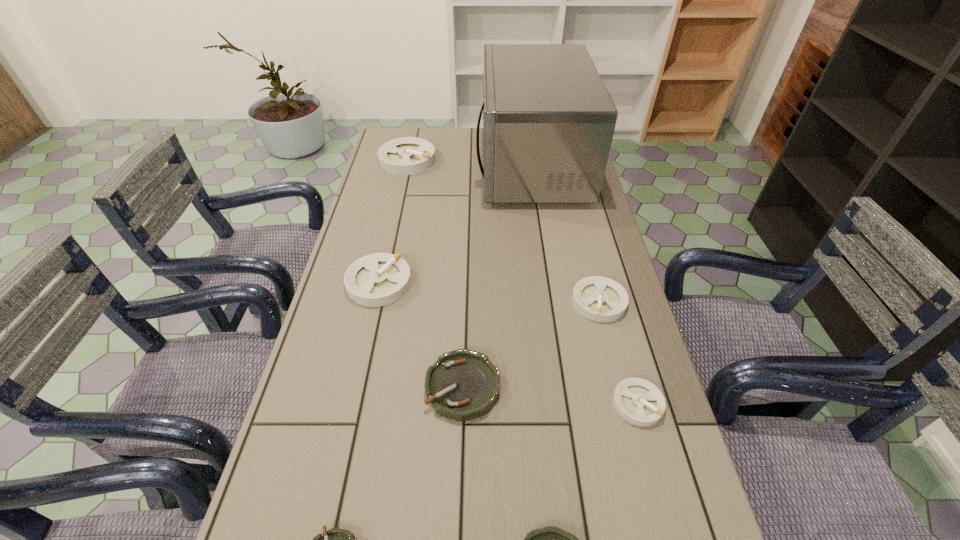
Image resolution: width=960 pixels, height=540 pixels. I want to click on microwave oven that is at the right edge, so click(x=548, y=120).

The image size is (960, 540). I want to click on object situated at the far left corner, so (x=409, y=155).

I want to click on object situated at the far right corner, so click(548, 120).

Identify the location of vacant region at the far edge. [x=424, y=134].

Where is `free space at the left edge of the desktop`? This screenshot has height=540, width=960. free space at the left edge of the desktop is located at coordinates (318, 394).

Where is `blank area at the right edge`? blank area at the right edge is located at coordinates (613, 270).

Image resolution: width=960 pixels, height=540 pixels. In the image, there is a desktop. Find the location of `vacant area at the far left corner`. vacant area at the far left corner is located at coordinates (423, 127).

At what (x,y) coordinates should I click in order to perform the action: click on vacant area that lies between the tallest object and the second smallest gray ashtray. Please return your answer as a coordinate pair (x, y). Looking at the image, I should click on [565, 233].

Where is `free area in between the third tallest object and the third biggest gray ashtray`? free area in between the third tallest object and the third biggest gray ashtray is located at coordinates (489, 292).

The image size is (960, 540). I want to click on vacant area between the smallest gray ashtray and the farthest green ashtray, so click(550, 395).